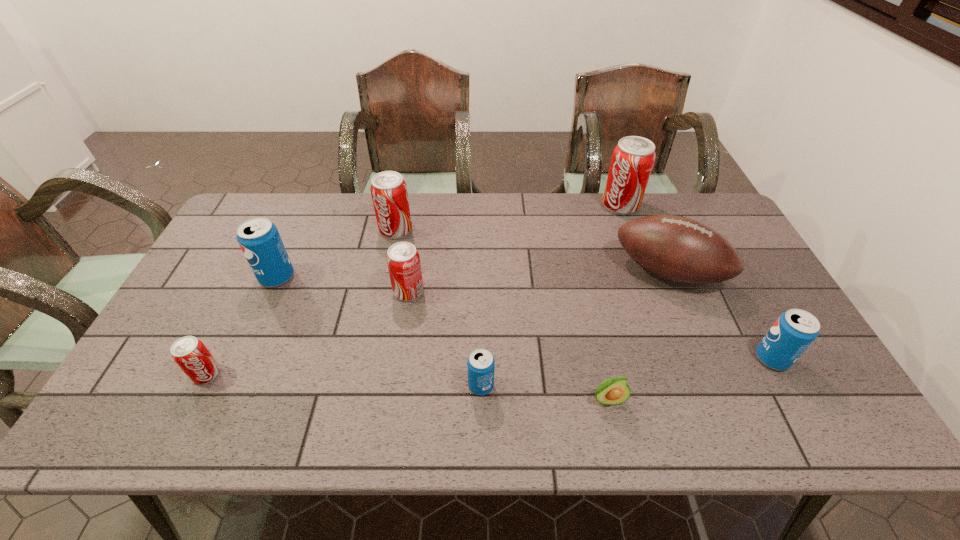
You are a GUI agent. You are given a task and a screenshot of the screen. Output one action in this format:
    pyautogui.click(x=<x>, y=<y>)
    Task: Click on the object that is the nearest to the eighth nearest object
    This screenshot has width=960, height=540.
    Given the screenshot: What is the action you would take?
    pyautogui.click(x=403, y=261)

Select which object appears as the fourth closest to the second blue soda can from right to left. Please provide its 2D coordinates. Your answer should be formatted as a tuple, i.e. [(x, y)], where the tuple contains the x and y coordinates of a point satisfying the conditions above.

[(388, 189)]

You are a GUI agent. You are given a task and a screenshot of the screen. Output one action in this format:
    pyautogui.click(x=<x>, y=<y>)
    Task: Click on the soda can that is the second closest one to the third biggest red soda can
    The image size is (960, 540).
    Given the screenshot: What is the action you would take?
    tap(480, 364)

Identify which soda can is the second closest to the second biggest blue soda can. Please provide its 2D coordinates. Your answer should be formatted as a tuple, i.e. [(x, y)], where the tuple contains the x and y coordinates of a point satisfying the conditions above.

[(480, 364)]

Identify which red soda can is the closest to the leftmost red soda can. Please provide its 2D coordinates. Your answer should be formatted as a tuple, i.e. [(x, y)], where the tuple contains the x and y coordinates of a point satisfying the conditions above.

[(403, 261)]

Identify which red soda can is the second closest to the third biggest red soda can. Please provide its 2D coordinates. Your answer should be formatted as a tuple, i.e. [(x, y)], where the tuple contains the x and y coordinates of a point satisfying the conditions above.

[(190, 354)]

Find the location of a particular element. blue soda can that can be found as the closest to the fifth soda can from left to right is located at coordinates (259, 239).

Locate an element on the screen. The height and width of the screenshot is (540, 960). blue soda can that is the second nearest to the rightmost soda can is located at coordinates (259, 239).

Find the location of a particular element. free space that satisfies the following two spatial constraints: 1. on the back side of the smallest red soda can; 2. on the left side of the second farthest object is located at coordinates (277, 230).